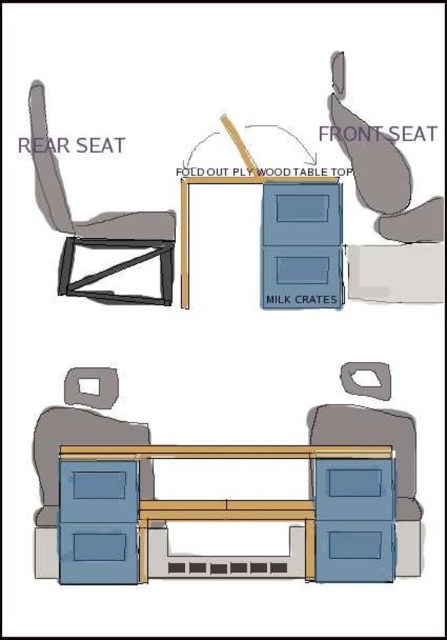
Is matte gray chair at rear wider than wooden table top at center?

Incorrect, matte gray chair at rear's width does not surpass wooden table top at center's.

At what (x,y) coordinates should I click in order to perform the action: click on matte gray chair at rear. Please return your answer as a coordinate pair (x, y). The image size is (447, 640). Looking at the image, I should click on (96, 224).

This screenshot has width=447, height=640. Identify the location of matte gray chair at rear. (96, 224).

Does blue matte cabinet at center appear on the left side of matte gray chair at rear?

In fact, blue matte cabinet at center is to the right of matte gray chair at rear.

Does blue matte cabinet at center have a greater width compared to matte gray chair at rear?

Indeed, blue matte cabinet at center has a greater width compared to matte gray chair at rear.

Where is `blue matte cabinet at center`? blue matte cabinet at center is located at coordinates point(226,515).

Which is more to the left, matte gray chair at rear or matte gray swivel chair at lower center?

Positioned to the left is matte gray chair at rear.

Does matte gray chair at rear have a larger size compared to matte gray swivel chair at lower center?

Correct, matte gray chair at rear is larger in size than matte gray swivel chair at lower center.

Does point (114, 298) come in front of point (118, 420)?

That is False.

The width and height of the screenshot is (447, 640). I want to click on matte gray chair at rear, so click(96, 224).